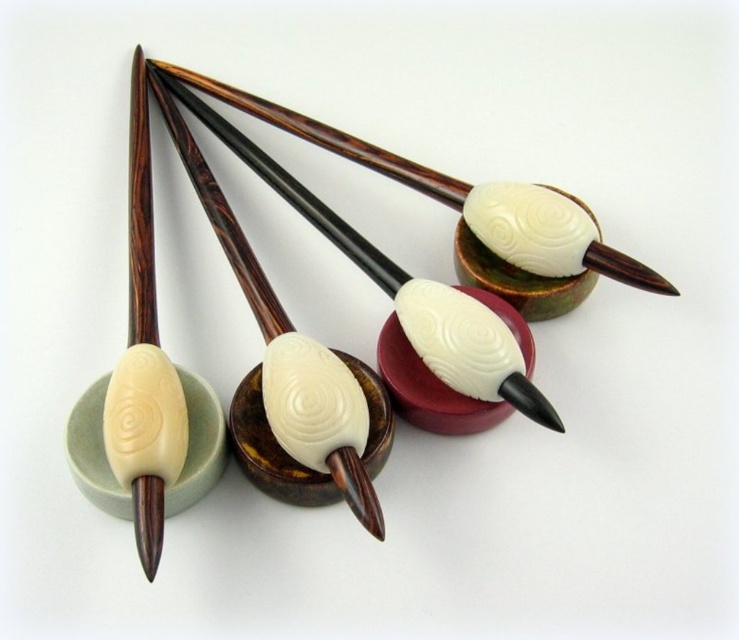
Question: Is green matte bowl at lower left below matte brown bowl at center?

Choices:
 (A) yes
 (B) no

Answer: (A)

Question: Can you confirm if matte brown bowl at center is bigger than green matte bowl at center?

Choices:
 (A) yes
 (B) no

Answer: (A)

Question: Which object appears farthest from the camera in this image?

Choices:
 (A) matte brown bowl at center
 (B) green matte bowl at lower left
 (C) wooden chopsticks at upper center
 (D) green matte bowl at center

Answer: (D)

Question: Which of the following is the closest to the observer?

Choices:
 (A) polished dark wood bowl at center
 (B) green matte bowl at center

Answer: (A)

Question: Does matte brown bowl at center have a lesser width compared to green matte bowl at center?

Choices:
 (A) yes
 (B) no

Answer: (B)

Question: Which point is closer to the camera?

Choices:
 (A) green matte bowl at center
 (B) matte brown bowl at center
 (C) polished dark wood bowl at center

Answer: (B)